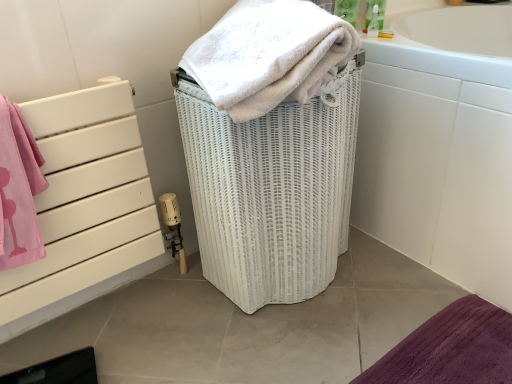
You are a GUI agent. You are given a task and a screenshot of the screen. Output one action in this format:
    pyautogui.click(x=<x>, y=<y>)
    Task: Click on the vacant space to the right of white wicker basket at center
    
    Given the screenshot: What is the action you would take?
    pyautogui.click(x=404, y=284)